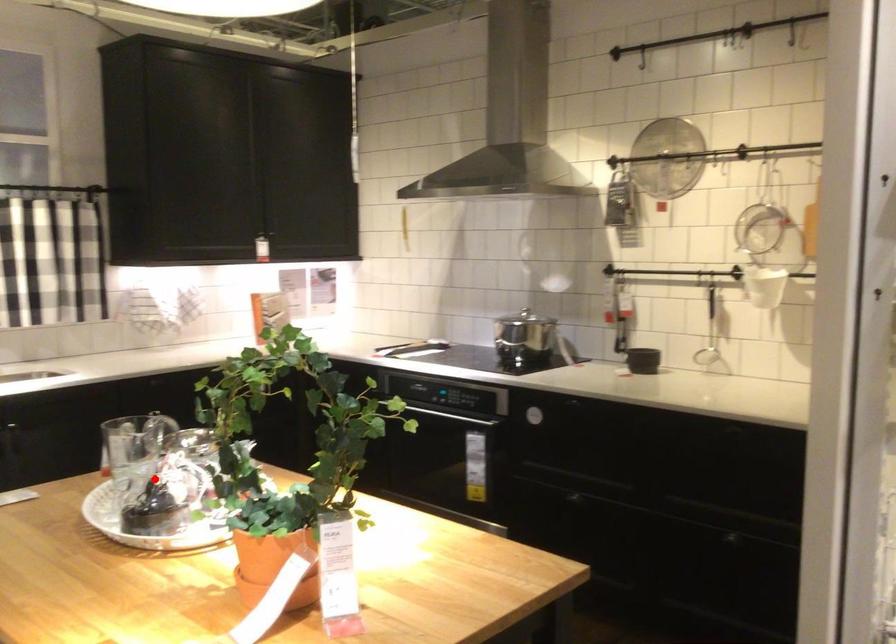
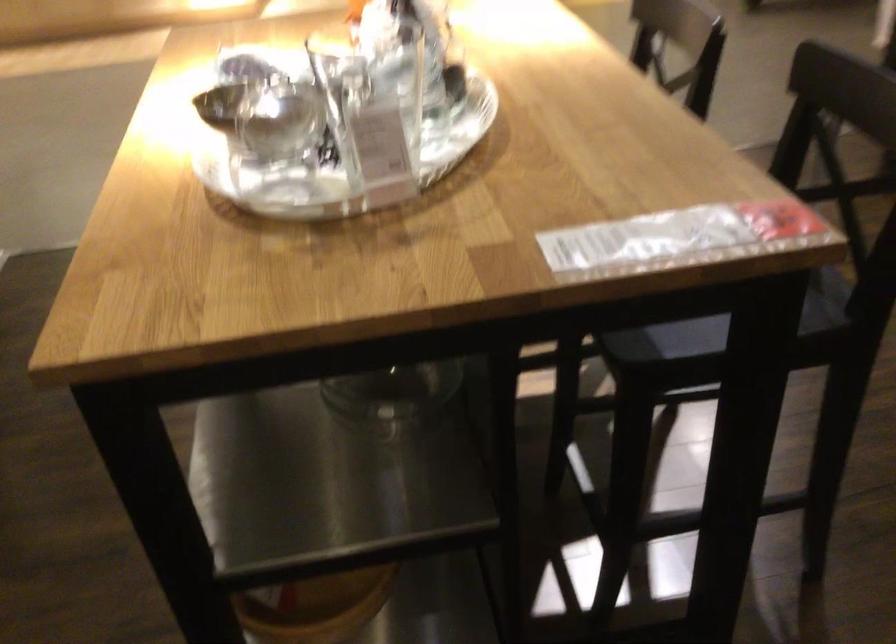
Question: I am providing you with two images of the same scene from different viewpoints. A red point is shown in image1. For the corresponding object point in image2, is it positioned nearer or farther from the camera?

Choices:
 (A) Nearer
 (B) Farther

Answer: (A)